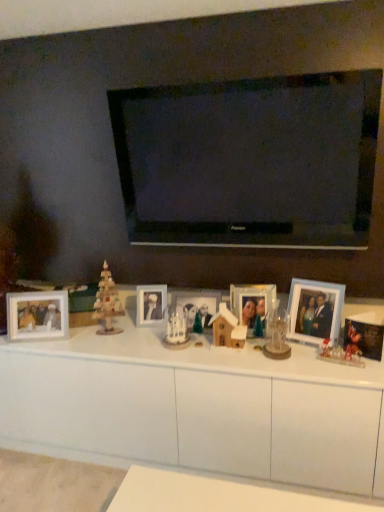
Question: From the image's perspective, is wooden photo frame at left, marked as the sixth picture frame in a right-to-left arrangement, positioned above or below clear glass photo frame at center, the third picture frame from the right?

Choices:
 (A) below
 (B) above

Answer: (A)

Question: Would you say wooden photo frame at left, placed as the first picture frame when sorted from left to right, is to the left or to the right of clear glass photo frame at center, the third picture frame from the right, in the picture?

Choices:
 (A) right
 (B) left

Answer: (B)

Question: Which object is positioned farthest from the matte white photo frame at center, the 5th picture frame viewed from the right?

Choices:
 (A) metallic mickey mouse photo frame at right, the 6th picture frame when ordered from left to right
 (B) matte silver photo frame at center, which ranks as the 3th picture frame in left-to-right order
 (C) translucent plastic gingerbread house at lower right, the 2th toy positioned from the back
 (D) clear glass photo frame at center, positioned as the 4th picture frame in left-to-right order
 (E) light blue plastic picture frame at right, marked as the 5th picture frame in a left-to-right arrangement

Answer: (A)

Question: Which is farther from the light blue plastic picture frame at right, which appears as the 2th picture frame when viewed from the right?

Choices:
 (A) white glossy cabinet at center
 (B) metallic mickey mouse photo frame at right, the 6th picture frame when ordered from left to right
 (C) wooden photo frame at left, placed as the first picture frame when sorted from left to right
 (D) wooden christmas tree at left
 (E) clear glass photo frame at center, positioned as the 4th picture frame in left-to-right order

Answer: (C)